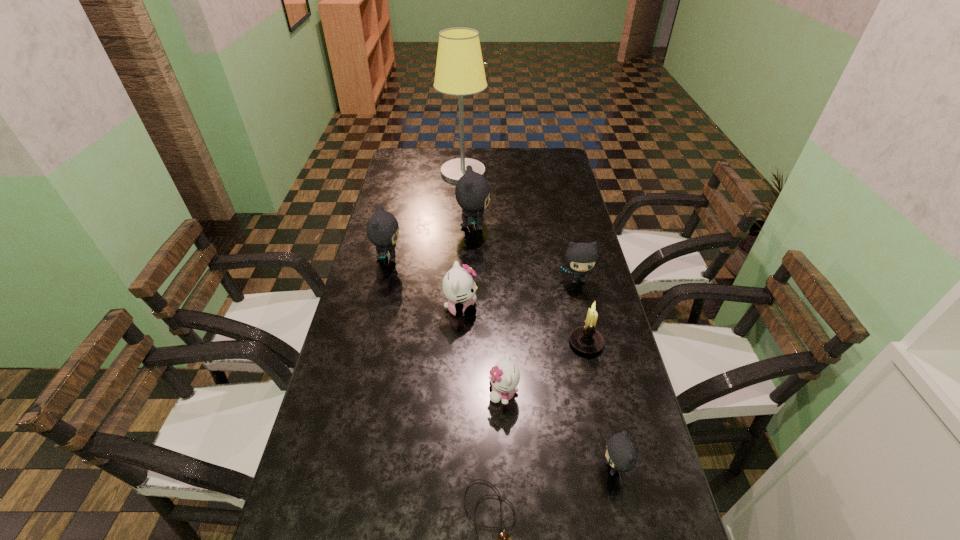
At what (x,y) coordinates should I click in order to perform the action: click on empty space between the third nearest kitten and the nearer white kitten. Please return your answer as a coordinate pair (x, y). Looking at the image, I should click on (482, 350).

The image size is (960, 540). I want to click on object that is the third closest one to the farthest object, so click(x=580, y=257).

Locate which object ranks eighth in proximity to the candle holder. Please provide its 2D coordinates. Your answer should be formatted as a tuple, i.e. [(x, y)], where the tuple contains the x and y coordinates of a point satisfying the conditions above.

[(459, 71)]

Locate an element on the screen. The image size is (960, 540). kitten that is the fourth closest one to the second smallest gray kitten is located at coordinates (382, 228).

Identify which kitten is the fourth closest to the table lamp. Please provide its 2D coordinates. Your answer should be formatted as a tuple, i.e. [(x, y)], where the tuple contains the x and y coordinates of a point satisfying the conditions above.

[(459, 287)]

This screenshot has width=960, height=540. I want to click on gray kitten that stands as the fourth closest to the right white kitten, so click(472, 191).

Where is `the third closest gray kitten to the third gray kitten from right to left`? the third closest gray kitten to the third gray kitten from right to left is located at coordinates (621, 454).

The height and width of the screenshot is (540, 960). Identify the location of free space that satisfies the following two spatial constraints: 1. on the front-facing side of the tallest kitten; 2. on the back side of the white candle holder. (471, 342).